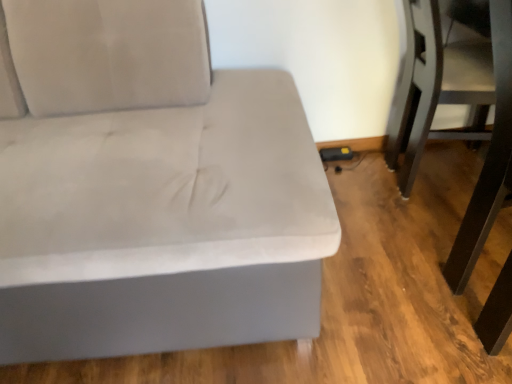
Locate an element on the screen. Image resolution: width=512 pixels, height=384 pixels. dark brown wood swivel chair at lower right is located at coordinates (435, 88).

The image size is (512, 384). What do you see at coordinates (435, 88) in the screenshot?
I see `dark brown wood swivel chair at lower right` at bounding box center [435, 88].

This screenshot has height=384, width=512. In order to click on suede-like gray couch at left in this screenshot , I will do `click(151, 189)`.

What do you see at coordinates (151, 189) in the screenshot? I see `suede-like gray couch at left` at bounding box center [151, 189].

Identify the location of dark brown wood swivel chair at lower right. This screenshot has width=512, height=384. (435, 88).

Between dark brown wood swivel chair at lower right and suede-like gray couch at left, which one appears on the right side from the viewer's perspective?

Positioned to the right is dark brown wood swivel chair at lower right.

Does dark brown wood swivel chair at lower right lie in front of suede-like gray couch at left?

That is False.

Does point (412, 158) come behind point (257, 192)?

Yes, it is.

From the image's perspective, is dark brown wood swivel chair at lower right above suede-like gray couch at left?

Yes, from the image's perspective, dark brown wood swivel chair at lower right is above suede-like gray couch at left.

From a real-world perspective, which object stands above the other?

suede-like gray couch at left, from a real-world perspective.

Can you confirm if dark brown wood swivel chair at lower right is thinner than suede-like gray couch at left?

Yes, dark brown wood swivel chair at lower right is thinner than suede-like gray couch at left.

Is dark brown wood swivel chair at lower right shorter than suede-like gray couch at left?

Indeed, dark brown wood swivel chair at lower right has a lesser height compared to suede-like gray couch at left.

Is dark brown wood swivel chair at lower right smaller than suede-like gray couch at left?

Indeed, dark brown wood swivel chair at lower right has a smaller size compared to suede-like gray couch at left.

Is dark brown wood swivel chair at lower right outside of suede-like gray couch at left?

Yes, dark brown wood swivel chair at lower right is located beyond the bounds of suede-like gray couch at left.

Is dark brown wood swivel chair at lower right positioned far away from suede-like gray couch at left?

No, dark brown wood swivel chair at lower right is not far from suede-like gray couch at left.

Does dark brown wood swivel chair at lower right turn towards suede-like gray couch at left?

No, dark brown wood swivel chair at lower right is not facing towards suede-like gray couch at left.

What's the angular difference between dark brown wood swivel chair at lower right and suede-like gray couch at left's facing directions?

88.4 degrees.

How far apart are dark brown wood swivel chair at lower right and suede-like gray couch at left?

dark brown wood swivel chair at lower right and suede-like gray couch at left are 31.87 inches apart from each other.

This screenshot has width=512, height=384. I want to click on swivel chair behind the suede-like gray couch at left, so click(x=435, y=88).

Visually, is suede-like gray couch at left positioned to the left or to the right of dark brown wood swivel chair at lower right?

Based on their positions, suede-like gray couch at left is located to the left of dark brown wood swivel chair at lower right.

In the image, is suede-like gray couch at left positioned in front of or behind dark brown wood swivel chair at lower right?

Visually, suede-like gray couch at left is located in front of dark brown wood swivel chair at lower right.

Considering the positions of point (45, 132) and point (474, 101), is point (45, 132) closer or farther from the camera than point (474, 101)?

Point (45, 132) appears to be closer to the viewer than point (474, 101).

From the image's perspective, is suede-like gray couch at left above or below dark brown wood swivel chair at lower right?

Based on their image positions, suede-like gray couch at left is located beneath dark brown wood swivel chair at lower right.

From a real-world perspective, is suede-like gray couch at left physically above dark brown wood swivel chair at lower right?

Yes, from a real-world perspective, suede-like gray couch at left is above dark brown wood swivel chair at lower right.

Does suede-like gray couch at left have a lesser width compared to dark brown wood swivel chair at lower right?

No, suede-like gray couch at left is not thinner than dark brown wood swivel chair at lower right.

Which of these two, suede-like gray couch at left or dark brown wood swivel chair at lower right, stands shorter?

dark brown wood swivel chair at lower right is shorter.

Considering the sizes of suede-like gray couch at left and dark brown wood swivel chair at lower right in the image, is suede-like gray couch at left bigger or smaller than dark brown wood swivel chair at lower right?

suede-like gray couch at left is bigger than dark brown wood swivel chair at lower right.

Is suede-like gray couch at left situated inside dark brown wood swivel chair at lower right or outside?

suede-like gray couch at left is located beyond the bounds of dark brown wood swivel chair at lower right.

Is suede-like gray couch at left far away from dark brown wood swivel chair at lower right?

They are positioned close to each other.

Is suede-like gray couch at left facing away from dark brown wood swivel chair at lower right?

suede-like gray couch at left does not have its back to dark brown wood swivel chair at lower right.

Find the location of a particular element. studio couch in front of the dark brown wood swivel chair at lower right is located at coordinates (151, 189).

Locate an element on the screen. This screenshot has height=384, width=512. swivel chair that is above the suede-like gray couch at left (from the image's perspective) is located at coordinates (435, 88).

Identify the location of swivel chair on the right of suede-like gray couch at left. The image size is (512, 384). (435, 88).